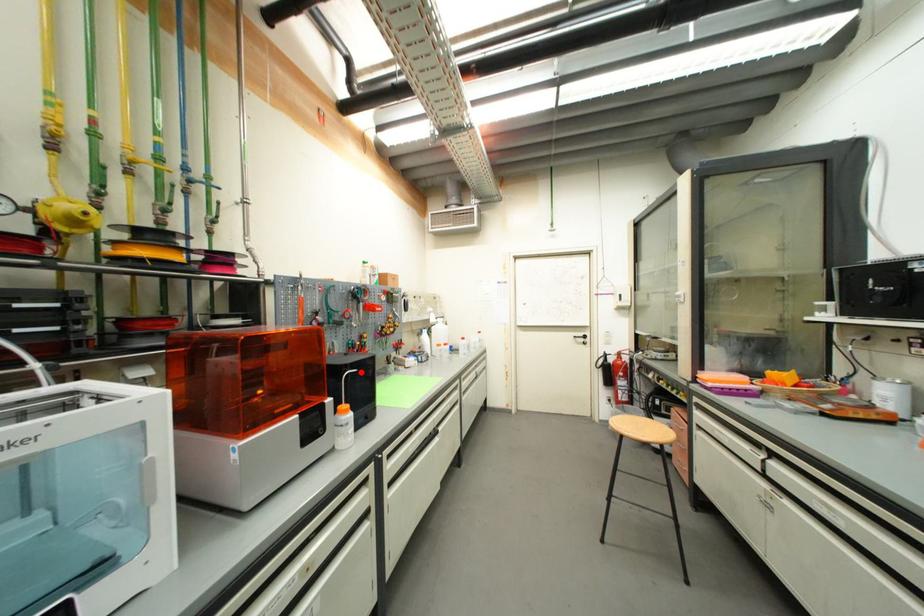
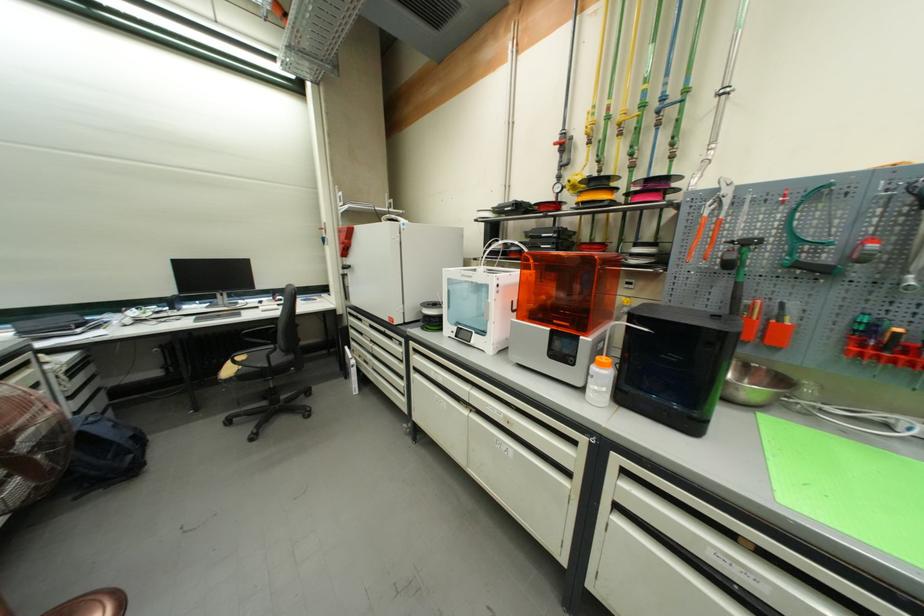
Question: I am providing you with two images of the same scene from different viewpoints. Given a red point in image1, look at the same physical point in image2. Is it:

Choices:
 (A) Closer to the viewpoint
 (B) Farther from the viewpoint

Answer: (B)